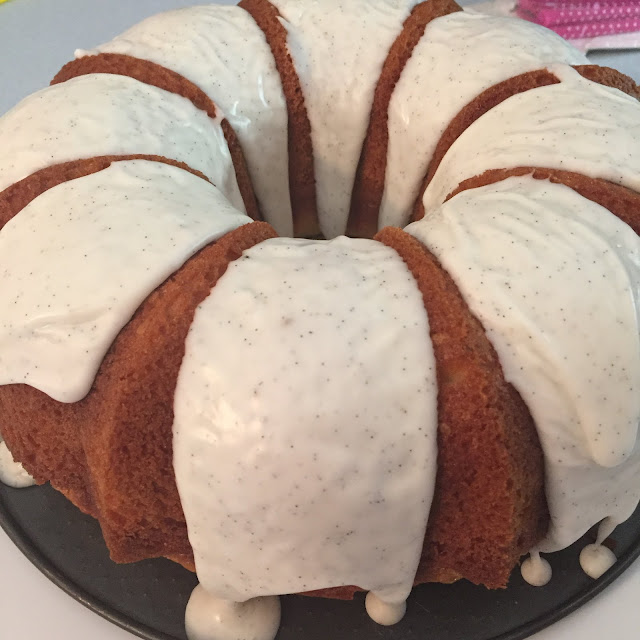
The image size is (640, 640). In order to click on dish in this screenshot , I will do click(621, 40), click(84, 540).